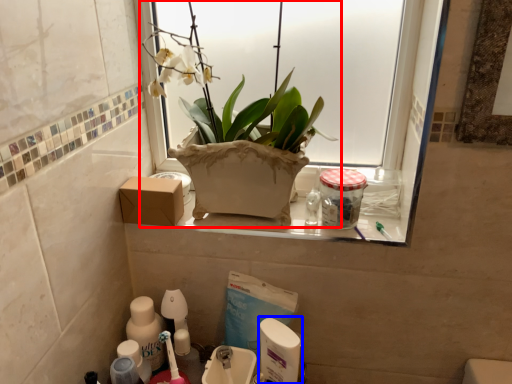
Question: Among these objects, which one is nearest to the camera, houseplant (highlighted by a red box) or cleaning product (highlighted by a blue box)?

Choices:
 (A) houseplant
 (B) cleaning product

Answer: (A)